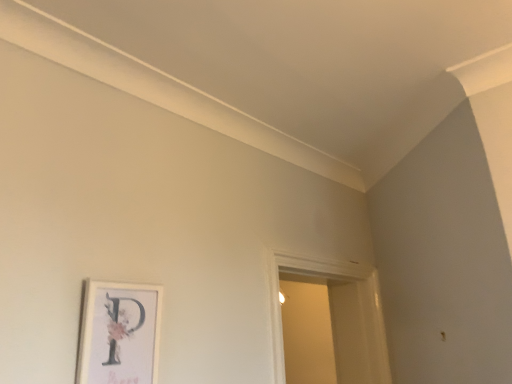
Where is `matte white picture frame at lower left`? The width and height of the screenshot is (512, 384). matte white picture frame at lower left is located at coordinates (119, 333).

The height and width of the screenshot is (384, 512). What do you see at coordinates (119, 333) in the screenshot?
I see `matte white picture frame at lower left` at bounding box center [119, 333].

In the scene shown: In order to face matte white picture frame at lower left, should I rotate leftwards or rightwards?

You should rotate left by 16.879 degrees.

I want to click on matte white picture frame at lower left, so click(x=119, y=333).